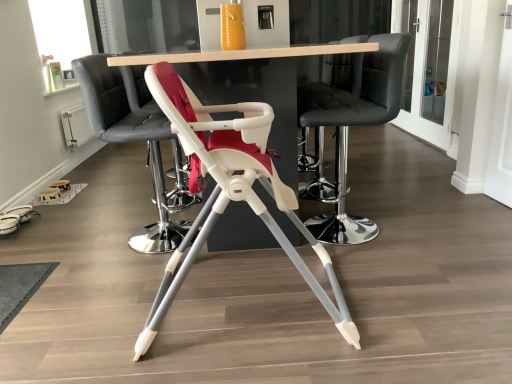
Find the location of `vacant space in front of black leather bar stool at center, arranged as the 3th chair when viewed from the back`. vacant space in front of black leather bar stool at center, arranged as the 3th chair when viewed from the back is located at coordinates (389, 264).